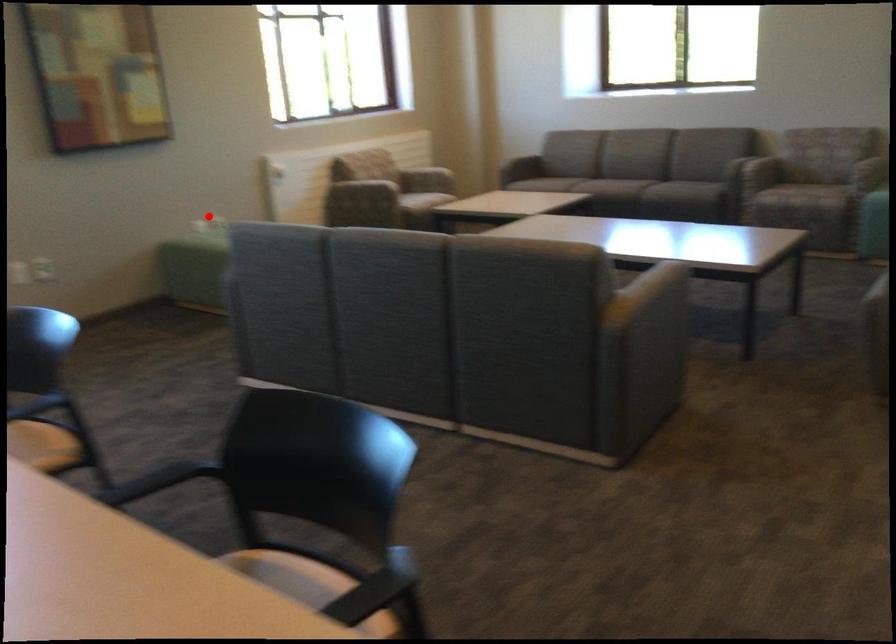
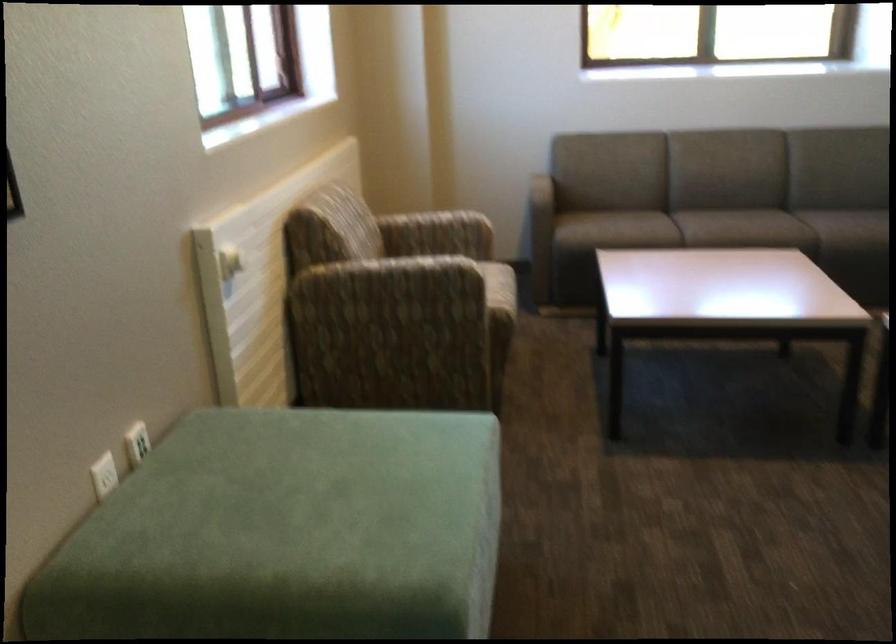
Question: I am providing you with two images of the same scene from different viewpoints. A red point is shown in image1. For the corresponding object point in image2, is it positioned nearer or farther from the camera?

Choices:
 (A) Nearer
 (B) Farther

Answer: (A)